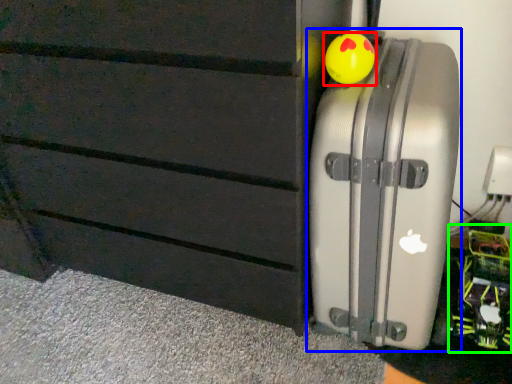
Question: Which object is the closest to the toy (highlighted by a red box)? Choose among these: suitcase (highlighted by a blue box) or toy (highlighted by a green box).

Choices:
 (A) suitcase
 (B) toy

Answer: (A)